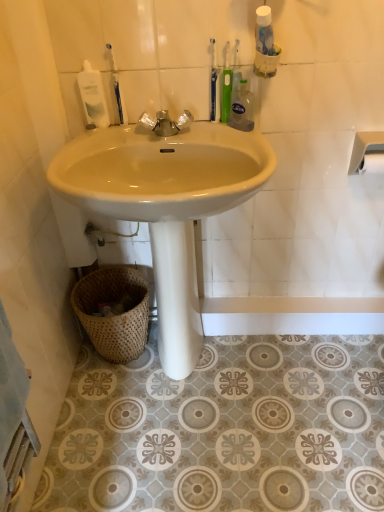
Find the location of a particular element. vacant area that is in front of clear liquid soap at upper center is located at coordinates (249, 142).